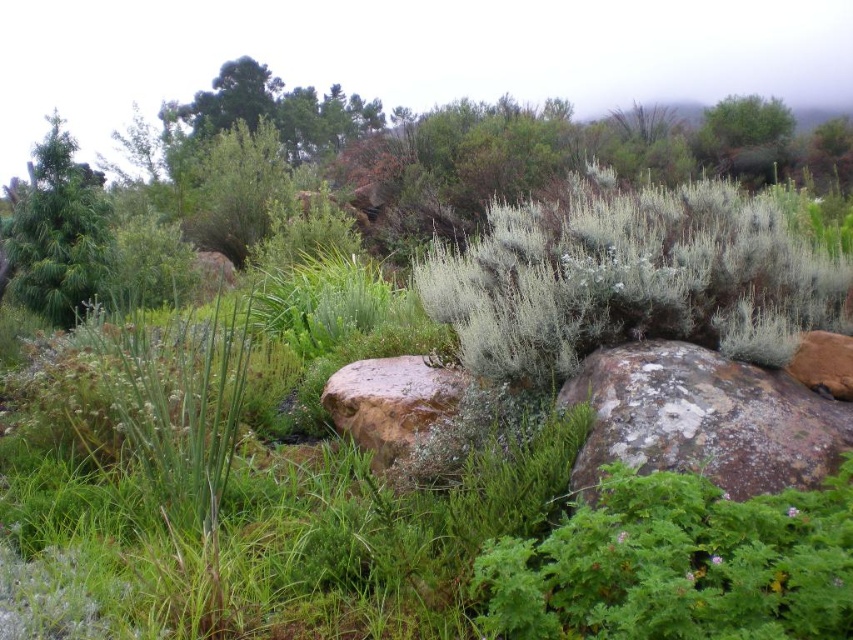
Measure the distance between brown rough boulder at center and green matte pine tree at left.

brown rough boulder at center is 19.95 feet from green matte pine tree at left.

Which is in front, point (364, 387) or point (24, 264)?

Point (364, 387)

The width and height of the screenshot is (853, 640). Identify the location of brown rough boulder at center. (415, 412).

Is point (821, 435) closer to camera compared to point (410, 385)?

That is True.

Can you confirm if speckled brown rock at center-right is thinner than brown rough boulder at center?

No, speckled brown rock at center-right is not thinner than brown rough boulder at center.

Where is `speckled brown rock at center-right`? This screenshot has height=640, width=853. speckled brown rock at center-right is located at coordinates (703, 419).

Where is `speckled brown rock at center-right`? This screenshot has width=853, height=640. speckled brown rock at center-right is located at coordinates (703, 419).

You are a GUI agent. You are given a task and a screenshot of the screen. Output one action in this format:
    pyautogui.click(x=<x>, y=<y>)
    Task: Click on the speckled brown rock at center-right
    The image size is (853, 640).
    Given the screenshot: What is the action you would take?
    pyautogui.click(x=703, y=419)

Who is shorter, speckled brown rock at center-right or green matte pine tree at left?

With less height is speckled brown rock at center-right.

Between point (785, 385) and point (97, 236), which one is positioned behind?

The point (97, 236) is behind.

Where is `speckled brown rock at center-right`? Image resolution: width=853 pixels, height=640 pixels. speckled brown rock at center-right is located at coordinates (703, 419).